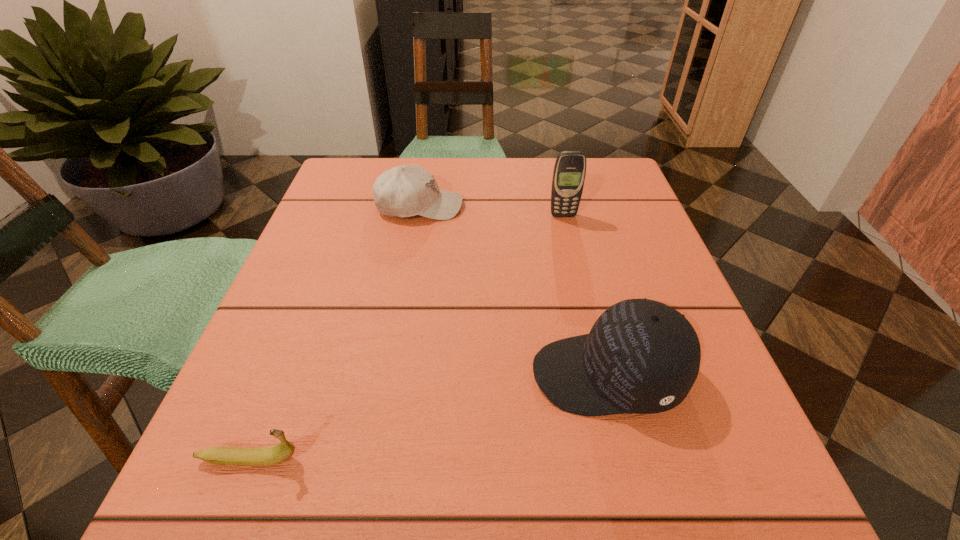
The width and height of the screenshot is (960, 540). I want to click on vacant space in between the taller baseball cap and the tallest object, so click(x=586, y=295).

Locate an element on the screen. blank region between the farther baseball cap and the cellular telephone is located at coordinates pyautogui.click(x=492, y=211).

You are a GUI agent. You are given a task and a screenshot of the screen. Output one action in this format:
    pyautogui.click(x=<x>, y=<y>)
    Task: Click on the free space between the nearer baseball cap and the tallest object
    The height and width of the screenshot is (540, 960).
    Given the screenshot: What is the action you would take?
    pyautogui.click(x=586, y=295)

Identify the location of vacant region between the right baseball cap and the shortest object. The image size is (960, 540). (429, 417).

Locate an element on the screen. The image size is (960, 540). free space between the cellular telephone and the nearer baseball cap is located at coordinates (586, 295).

The image size is (960, 540). I want to click on empty space that is in between the banana and the second tallest object, so click(x=429, y=417).

At what (x,y) coordinates should I click in order to perform the action: click on vacant space that's between the tallest object and the shorter baseball cap. Please return your answer as a coordinate pair (x, y). Looking at the image, I should click on (492, 211).

This screenshot has width=960, height=540. What are the coordinates of `object that is the third closest one to the tallest object` in the screenshot? It's located at (221, 455).

Identify which object is the third closest to the second shortest object. Please provide its 2D coordinates. Your answer should be formatted as a tuple, i.e. [(x, y)], where the tuple contains the x and y coordinates of a point satisfying the conditions above.

[(221, 455)]